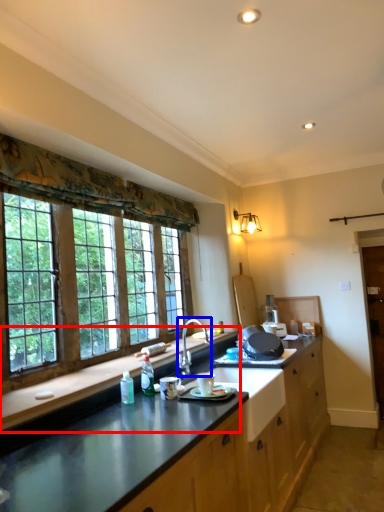
Question: Which object appears farthest to the camera in this image, countertop (highlighted by a red box) or sink (highlighted by a blue box)?

Choices:
 (A) countertop
 (B) sink

Answer: (B)